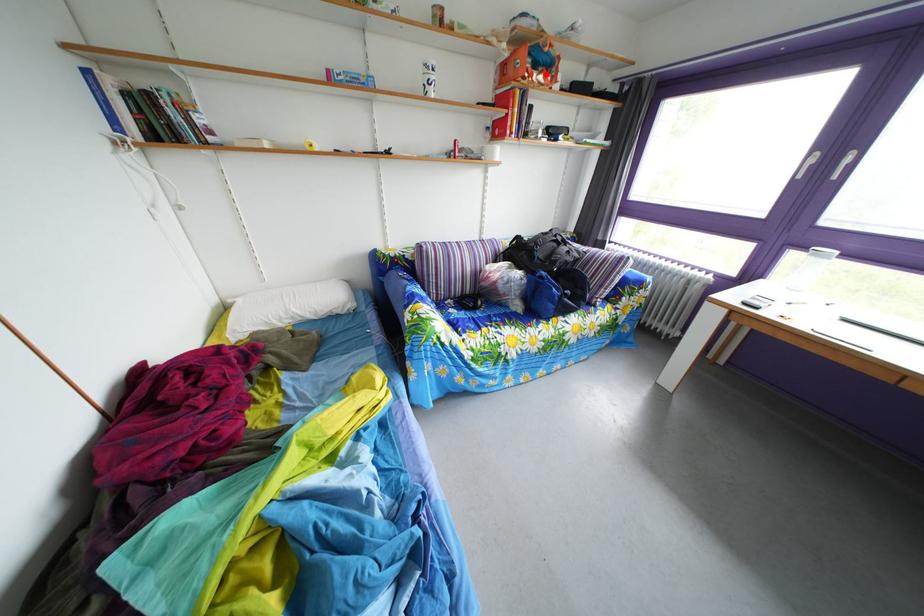
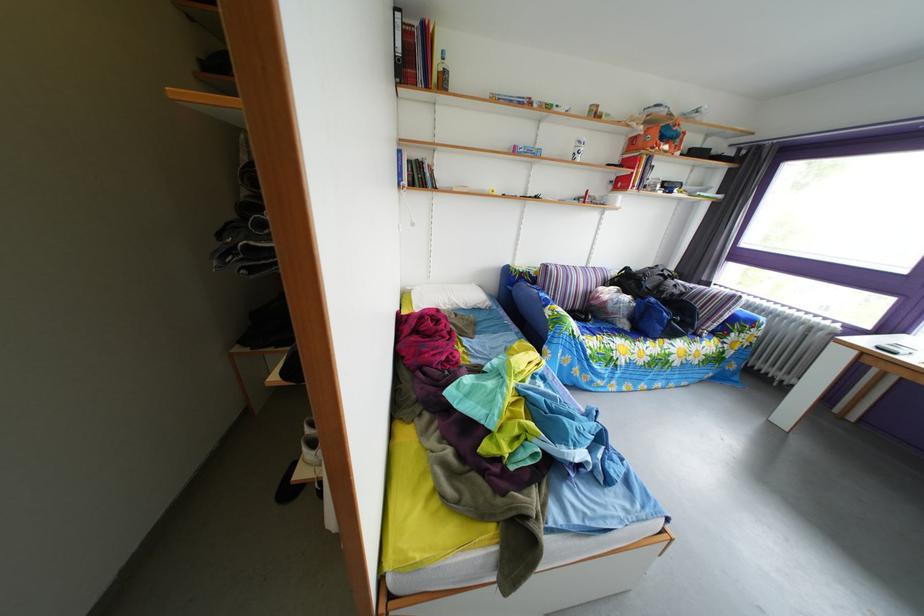
Where in the second image is the point corresponding to the highlighted location from the first image?

(673, 147)